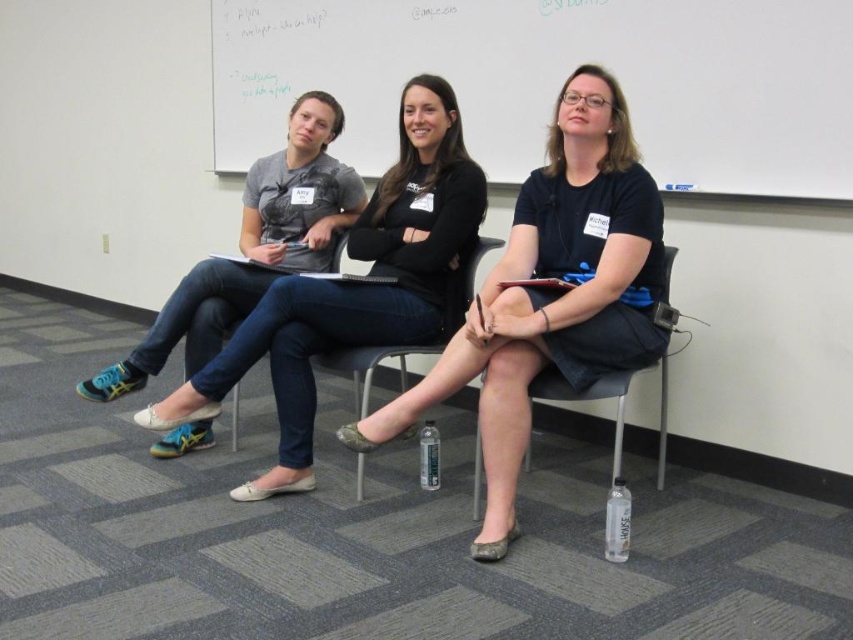
Between point (502, 380) and point (476, 515), which one is positioned in front?

Point (502, 380) is more forward.

Is point (503, 332) less distant than point (479, 493)?

Yes, it is.

Locate an element on the screen. The height and width of the screenshot is (640, 853). matte black dress at center is located at coordinates pos(550,292).

Does whiteboard at upper center have a greater width compared to matte gray t-shirt at center?

Correct, the width of whiteboard at upper center exceeds that of matte gray t-shirt at center.

Find the location of a particular element. The width and height of the screenshot is (853, 640). whiteboard at upper center is located at coordinates (556, 81).

Describe the element at coordinates (556, 81) in the screenshot. I see `whiteboard at upper center` at that location.

Locate an element on the screen. The height and width of the screenshot is (640, 853). whiteboard at upper center is located at coordinates (556, 81).

Is point (292, 67) positioned after point (498, 237)?

Yes, it is.

In the scene shown: Measure the distance from whiteboard at upper center to metallic silver chair at center.

whiteboard at upper center is 1.15 meters away from metallic silver chair at center.

Does point (672, 134) come behind point (236, 394)?

No, (672, 134) is closer to viewer.

Find the location of a particular element. The image size is (853, 640). whiteboard at upper center is located at coordinates (556, 81).